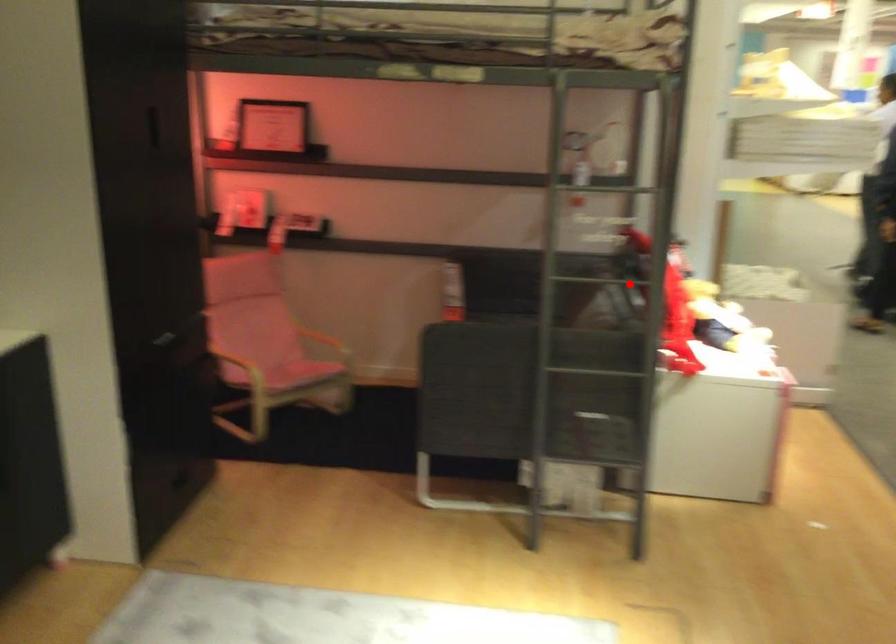
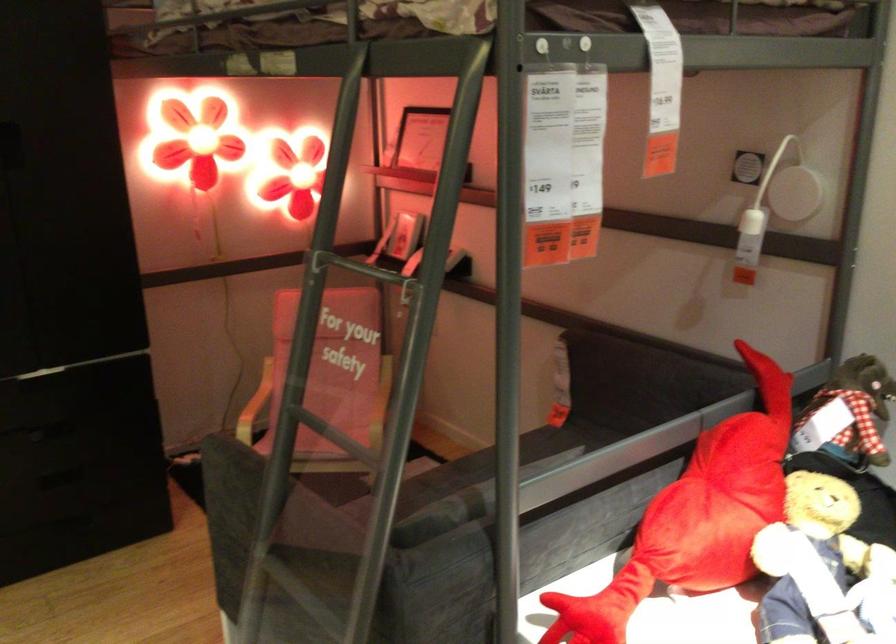
Question: I am providing you with two images of the same scene from different viewpoints. Given a red point in image1, look at the same physical point in image2. Is it:

Choices:
 (A) Closer to the viewpoint
 (B) Farther from the viewpoint

Answer: (A)